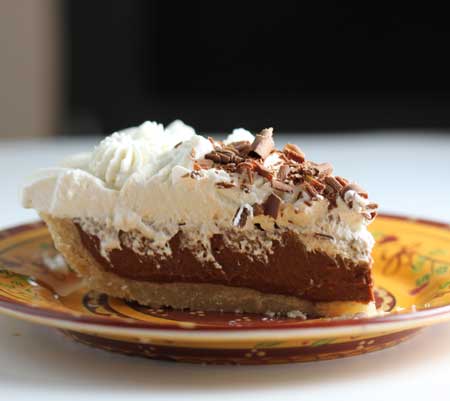
At what (x,y) coordinates should I click in order to perform the action: click on yellow and red plate. Please return your answer as a coordinate pair (x, y). Looking at the image, I should click on (33, 293).